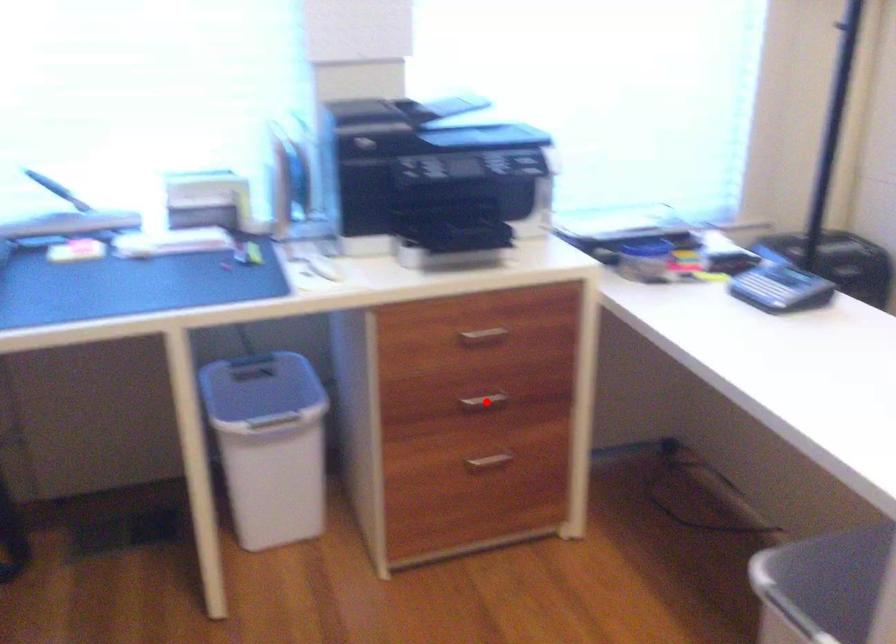
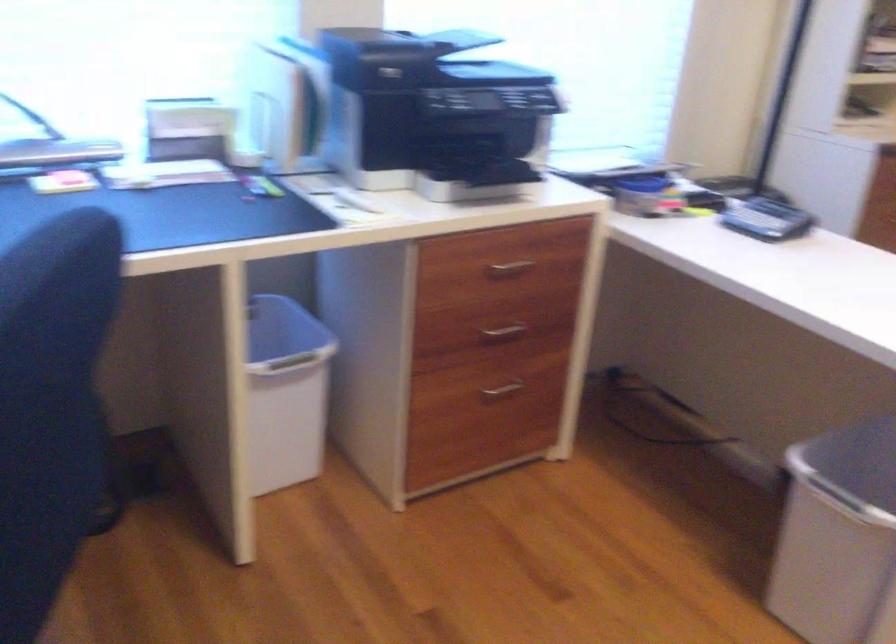
The point at the highlighted location is marked in the first image. Where is the corresponding point in the second image?

(503, 330)